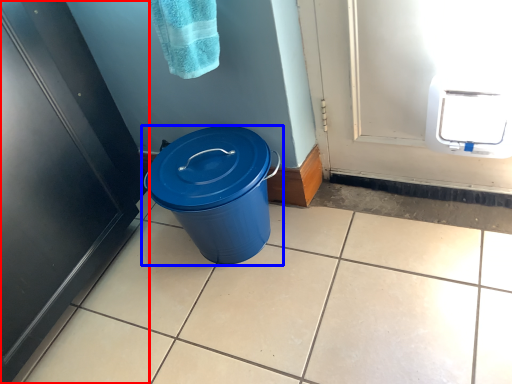
Question: Which point is further to the camera, door (highlighted by a red box) or waste container (highlighted by a blue box)?

Choices:
 (A) door
 (B) waste container

Answer: (B)